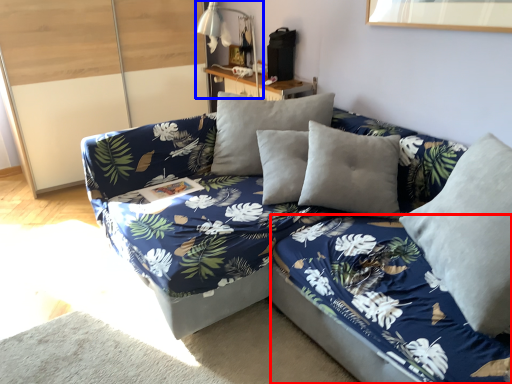
Question: Which of the following is the farthest to the observer, bed frame (highlighted by a red box) or table lamp (highlighted by a blue box)?

Choices:
 (A) bed frame
 (B) table lamp

Answer: (B)